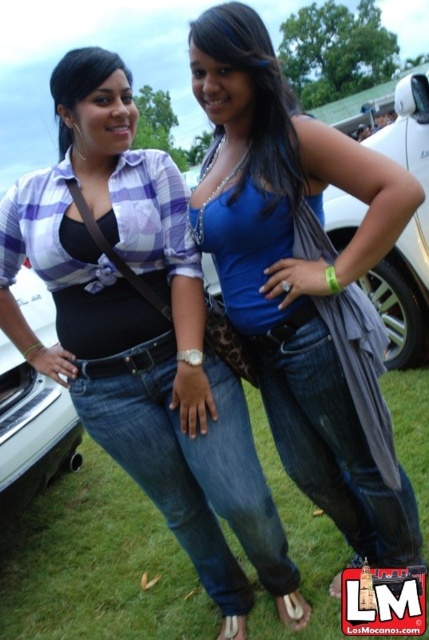
Question: Based on their relative distances, which object is farther from the green grass at lower center?

Choices:
 (A) matte black car at center
 (B) matte black top at center

Answer: (A)

Question: Which point is closer to the camera?

Choices:
 (A) matte black top at center
 (B) green grass at lower center
 (C) blue matte tank top at center
 (D) black leather car at left

Answer: (C)

Question: Does matte black car at center come behind black leather car at left?

Choices:
 (A) no
 (B) yes

Answer: (A)

Question: Does blue matte tank top at center appear on the left side of green grass at lower center?

Choices:
 (A) yes
 (B) no

Answer: (B)

Question: Is matte black tank top at center smaller than matte black top at center?

Choices:
 (A) yes
 (B) no

Answer: (B)

Question: Estimate the real-world distances between objects in this image. Which object is farther from the matte black tank top at center?

Choices:
 (A) matte black top at center
 (B) matte black car at center
 (C) green grass at lower center

Answer: (B)